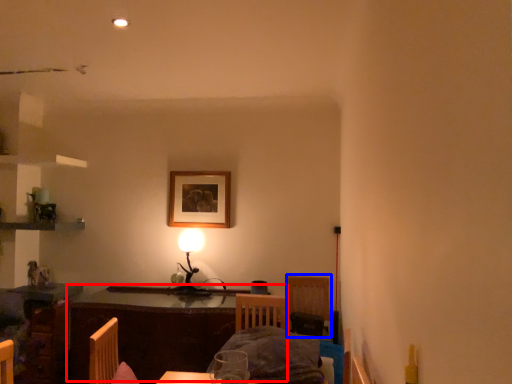
Question: Among these objects, which one is nearest to the camera, table (highlighted by a red box) or armchair (highlighted by a blue box)?

Choices:
 (A) table
 (B) armchair

Answer: (A)